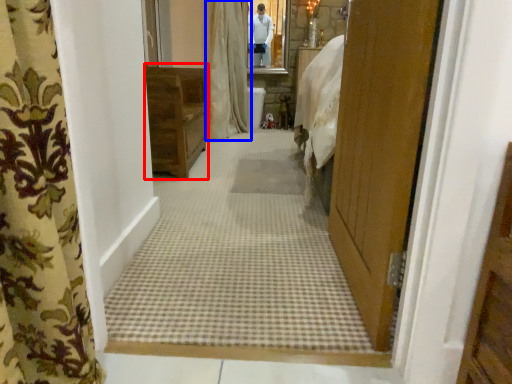
Question: Which point is closer to the camera, furniture (highlighted by a red box) or curtain (highlighted by a blue box)?

Choices:
 (A) furniture
 (B) curtain

Answer: (A)